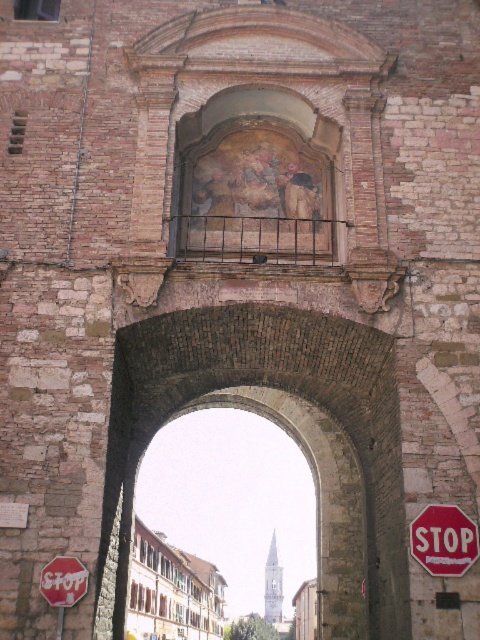
You are a tour guide explaining the layout of this historic site to visitors. You mention the rusty metal balcony at upper center and the red matte stop sign at lower left. Can you tell the visitors how far apart these two landmarks are?

The rusty metal balcony at upper center is 20.58 meters away from the red matte stop sign at lower left.

You are standing in front of the historic stone archway and want to take a photo of the point at coordinates point (x=202, y=248). If your camera has a maximum focus range of 50 meters, will it be able to focus on that point?

The distance of point (x=202, y=248) from the viewer is 50.72 meters, which exceeds the camera maximum focus range of 50 meters. Therefore, the camera cannot focus on that point.